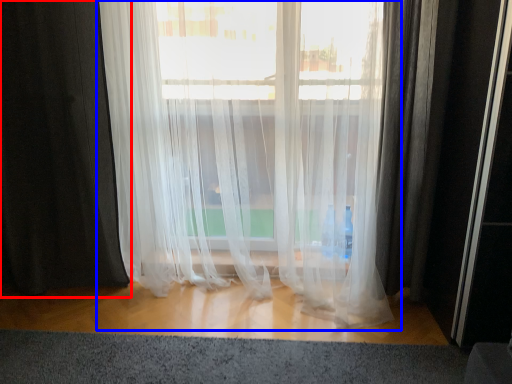
Question: Which point is closer to the camera, curtain (highlighted by a red box) or curtain (highlighted by a blue box)?

Choices:
 (A) curtain
 (B) curtain

Answer: (B)